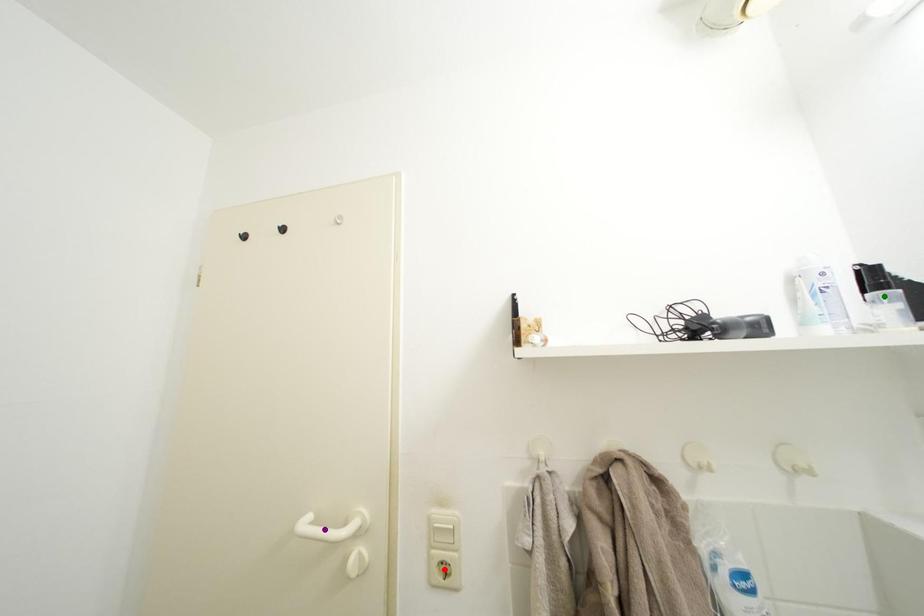
Order these from nearest to farthest:
1. purple point
2. green point
3. red point

green point → red point → purple point